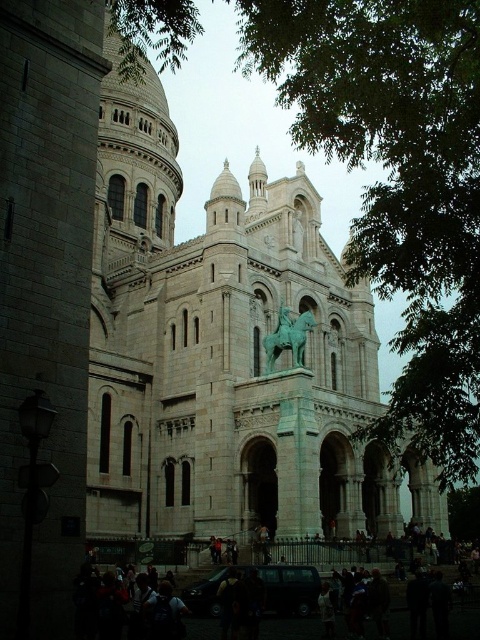
Question: Is green leafy tree at upper right bigger than green patina statue at center?

Choices:
 (A) yes
 (B) no

Answer: (A)

Question: Can you confirm if green leafy tree at upper right is wider than green patina statue at center?

Choices:
 (A) yes
 (B) no

Answer: (A)

Question: Is green leafy tree at upper right wider than green patina statue at center?

Choices:
 (A) no
 (B) yes

Answer: (B)

Question: Which of the following is the closest to the observer?

Choices:
 (A) green patina statue at center
 (B) green leafy tree at upper right

Answer: (B)